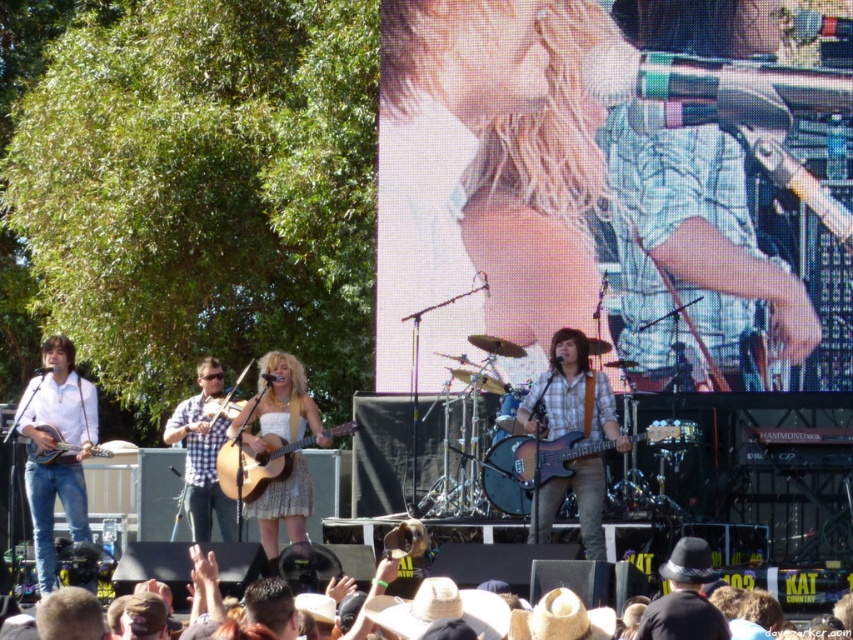
You are a photographer at the concert. You want to capture a photo that includes both the brown straw hats at lower center and the white lace dress at center. Which object should you focus on first to ensure both are in frame?

The brown straw hats at lower center are shorter than the white lace dress at center. To ensure both are in frame, focus on the white lace dress at center first as it is taller, allowing the shorter hats to be captured in the foreground.

You are a photographer at the concert and want to capture a photo of the crowd. You notice a point at coordinates (811, 588). What object is located at that point?

The point at coordinates (811, 588) is on brown straw hats at lower center.

You are a photographer at the concert and want to capture both the plaid fabric guitar at center and the wooden acoustic guitar at center in a single shot. Which guitar should you position to the left side of your frame to ensure both are visible?

You should position the wooden acoustic guitar at center to the left side of your frame because the plaid fabric guitar at center is already to its right, so placing the wooden one on the left will keep both within the shot.